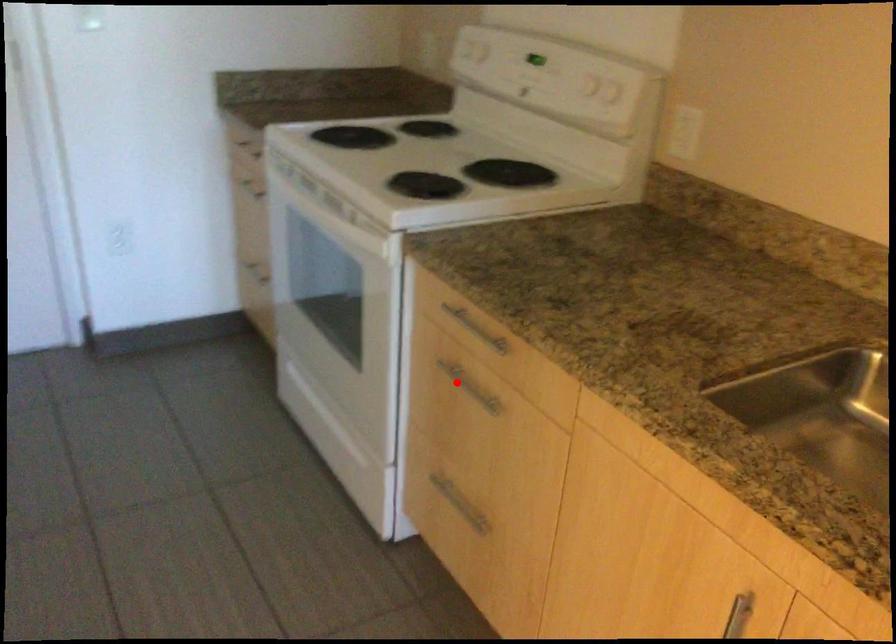
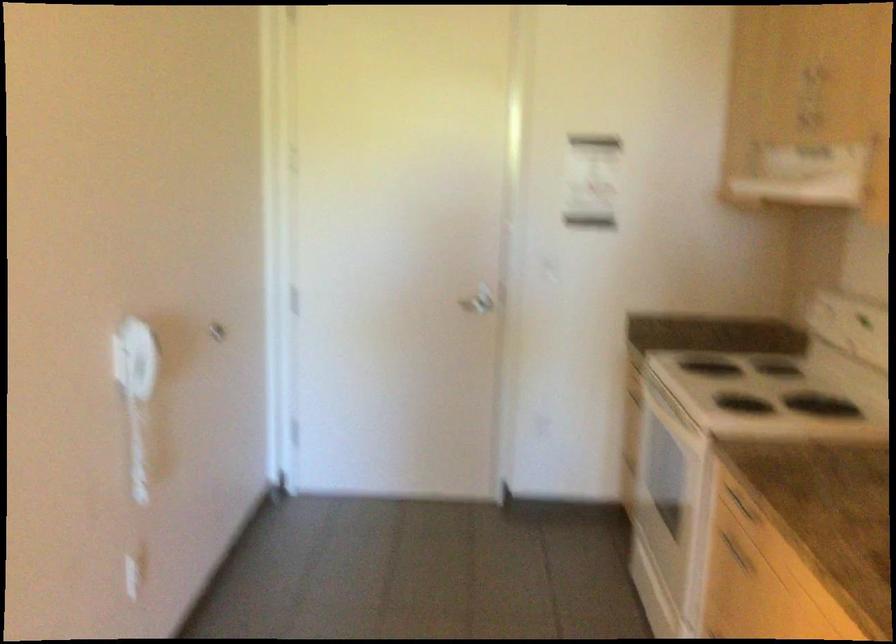
Question: I am providing you with two images of the same scene from different viewpoints. Given a red point in image1, look at the same physical point in image2. Is it:

Choices:
 (A) Closer to the viewpoint
 (B) Farther from the viewpoint

Answer: (B)